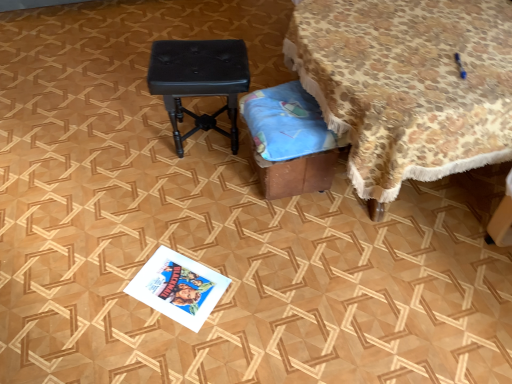
Question: Does floral fabric-covered table at upper right have a greater width compared to black leather stool at center?

Choices:
 (A) no
 (B) yes

Answer: (B)

Question: Is floral fabric-covered table at upper right facing away from black leather stool at center?

Choices:
 (A) no
 (B) yes

Answer: (A)

Question: Considering the relative positions of floral fabric-covered table at upper right and black leather stool at center in the image provided, is floral fabric-covered table at upper right in front of black leather stool at center?

Choices:
 (A) no
 (B) yes

Answer: (B)

Question: Can black leather stool at center be found inside floral fabric-covered table at upper right?

Choices:
 (A) no
 (B) yes

Answer: (A)

Question: Is floral fabric-covered table at upper right at the right side of black leather stool at center?

Choices:
 (A) yes
 (B) no

Answer: (A)

Question: Does floral fabric-covered table at upper right come behind black leather stool at center?

Choices:
 (A) yes
 (B) no

Answer: (B)

Question: Is brown cardboard box at lower center oriented towards white glossy magazine at lower center?

Choices:
 (A) yes
 (B) no

Answer: (B)

Question: Does brown cardboard box at lower center have a greater height compared to white glossy magazine at lower center?

Choices:
 (A) no
 (B) yes

Answer: (B)

Question: Considering the relative positions of brown cardboard box at lower center and white glossy magazine at lower center in the image provided, is brown cardboard box at lower center to the left of white glossy magazine at lower center from the viewer's perspective?

Choices:
 (A) yes
 (B) no

Answer: (B)

Question: Considering the relative sizes of brown cardboard box at lower center and white glossy magazine at lower center in the image provided, is brown cardboard box at lower center wider than white glossy magazine at lower center?

Choices:
 (A) no
 (B) yes

Answer: (B)

Question: From a real-world perspective, is brown cardboard box at lower center positioned over white glossy magazine at lower center based on gravity?

Choices:
 (A) yes
 (B) no

Answer: (A)

Question: Is brown cardboard box at lower center shorter than white glossy magazine at lower center?

Choices:
 (A) yes
 (B) no

Answer: (B)

Question: Considering the relative sizes of black leather stool at center and brown cardboard box at lower center in the image provided, is black leather stool at center smaller than brown cardboard box at lower center?

Choices:
 (A) no
 (B) yes

Answer: (A)